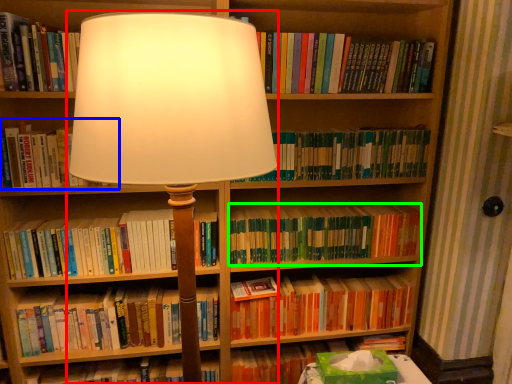
Question: Which object is the closest to the lamp (highlighted by a red box)? Choose among these: book (highlighted by a blue box) or book (highlighted by a green box).

Choices:
 (A) book
 (B) book

Answer: (A)